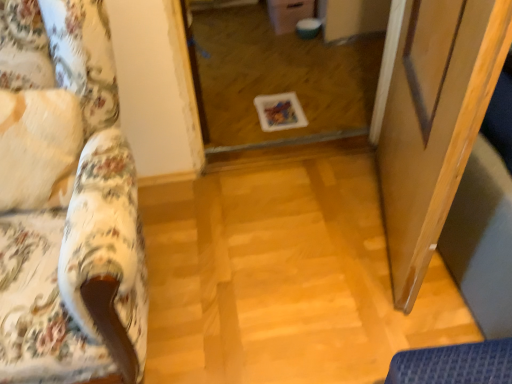
Question: Is floral fabric couch at left next to transparent glass screen door at right?

Choices:
 (A) yes
 (B) no

Answer: (B)

Question: Is transparent glass screen door at right at the back of floral fabric couch at left?

Choices:
 (A) yes
 (B) no

Answer: (B)

Question: Is floral fabric couch at left far away from transparent glass screen door at right?

Choices:
 (A) no
 (B) yes

Answer: (A)

Question: Does floral fabric couch at left have a greater width compared to transparent glass screen door at right?

Choices:
 (A) yes
 (B) no

Answer: (A)

Question: Can you confirm if floral fabric couch at left is positioned to the right of transparent glass screen door at right?

Choices:
 (A) no
 (B) yes

Answer: (A)

Question: Visually, is transparent glass door at center positioned to the left or to the right of floral fabric couch at left?

Choices:
 (A) left
 (B) right

Answer: (B)

Question: Is transparent glass door at center situated inside floral fabric couch at left or outside?

Choices:
 (A) inside
 (B) outside

Answer: (B)

Question: From the image's perspective, is transparent glass door at center above or below floral fabric couch at left?

Choices:
 (A) below
 (B) above

Answer: (B)

Question: Considering the positions of transparent glass door at center and floral fabric couch at left in the image, is transparent glass door at center wider or thinner than floral fabric couch at left?

Choices:
 (A) wide
 (B) thin

Answer: (A)

Question: Is transparent glass screen door at right in front of or behind transparent glass door at center in the image?

Choices:
 (A) front
 (B) behind

Answer: (A)

Question: Does point (409, 256) appear closer or farther from the camera than point (281, 77)?

Choices:
 (A) closer
 (B) farther

Answer: (A)

Question: Is transparent glass screen door at right situated inside transparent glass door at center or outside?

Choices:
 (A) outside
 (B) inside

Answer: (A)

Question: From the image's perspective, is transparent glass screen door at right positioned above or below transparent glass door at center?

Choices:
 (A) below
 (B) above

Answer: (A)

Question: From a real-world perspective, is transparent glass screen door at right physically located above or below floral fabric couch at left?

Choices:
 (A) below
 (B) above

Answer: (A)

Question: Considering the positions of point (391, 178) and point (110, 76), is point (391, 178) closer or farther from the camera than point (110, 76)?

Choices:
 (A) farther
 (B) closer

Answer: (A)